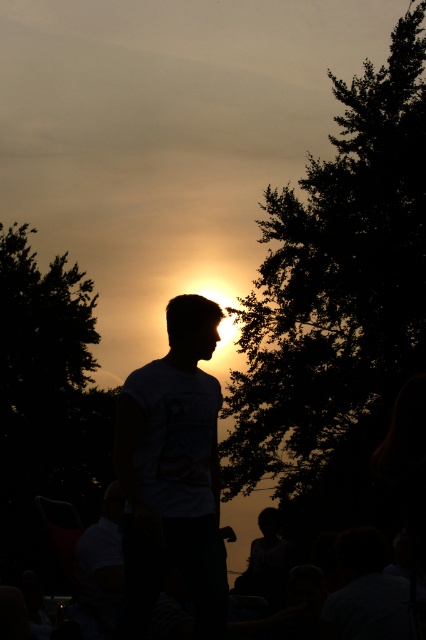
Question: Is silhouette t-shirt at center closer to camera compared to silhouette crowd at center?

Choices:
 (A) no
 (B) yes

Answer: (B)

Question: Which object is positioned farthest from the silhouette crowd at center?

Choices:
 (A) silhouette t-shirt at center
 (B) dark green leafy tree at right

Answer: (B)

Question: Which point is farther to the camera?

Choices:
 (A) dark green leafy tree at right
 (B) silhouette t-shirt at center

Answer: (B)

Question: Is silhouette t-shirt at center to the left of silhouette crowd at center from the viewer's perspective?

Choices:
 (A) no
 (B) yes

Answer: (A)

Question: Which object is the closest to the dark green leafy tree at right?

Choices:
 (A) silhouette t-shirt at center
 (B) silhouette crowd at center

Answer: (A)

Question: Is dark green leafy tree at right to the right of silhouette t-shirt at center from the viewer's perspective?

Choices:
 (A) no
 (B) yes

Answer: (B)